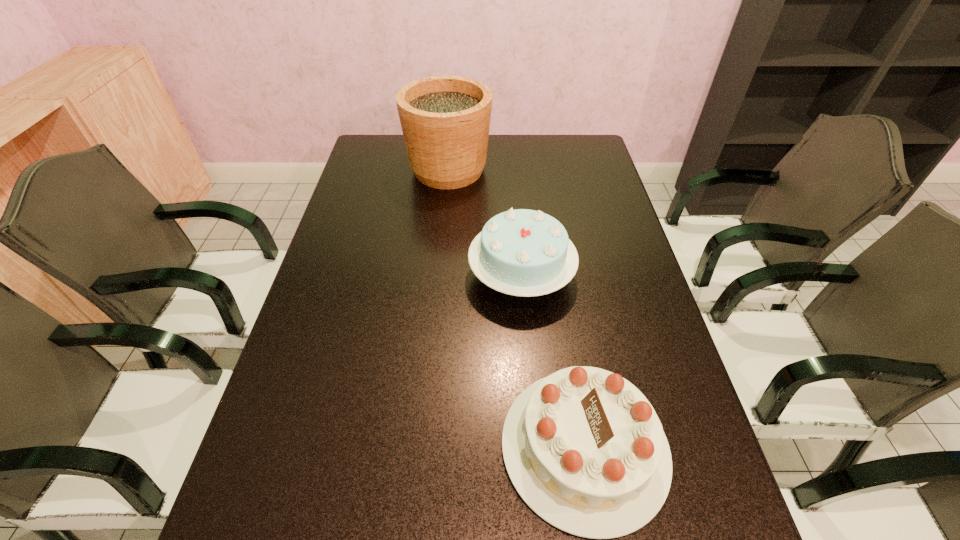
In order to click on vacant area at the far left corner of the desktop in this screenshot , I will do `click(363, 163)`.

Find the location of `free point between the tallest object and the second shortest object`. free point between the tallest object and the second shortest object is located at coordinates (485, 222).

Where is `free space between the tallest object and the taller birthday cake`? The height and width of the screenshot is (540, 960). free space between the tallest object and the taller birthday cake is located at coordinates (485, 222).

Where is `vacant point located between the taller birthday cake and the flowerpot`? vacant point located between the taller birthday cake and the flowerpot is located at coordinates (485, 222).

Where is `empty space between the farthest object and the taller birthday cake`? The image size is (960, 540). empty space between the farthest object and the taller birthday cake is located at coordinates (485, 222).

Identify which object is located as the second nearest to the second nearest object. Please provide its 2D coordinates. Your answer should be formatted as a tuple, i.e. [(x, y)], where the tuple contains the x and y coordinates of a point satisfying the conditions above.

[(445, 120)]

Point out which object is positioned as the nearest to the taller birthday cake. Please provide its 2D coordinates. Your answer should be formatted as a tuple, i.e. [(x, y)], where the tuple contains the x and y coordinates of a point satisfying the conditions above.

[(584, 448)]

Find the location of a particular element. The image size is (960, 540). vacant area that satisfies the following two spatial constraints: 1. on the front side of the taller birthday cake; 2. on the left side of the farthest object is located at coordinates 439,275.